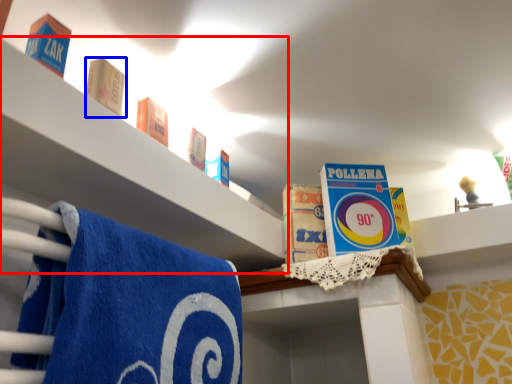
Question: Which object appears farthest to the camera in this image, shelf (highlighted by a red box) or product (highlighted by a blue box)?

Choices:
 (A) shelf
 (B) product

Answer: (B)